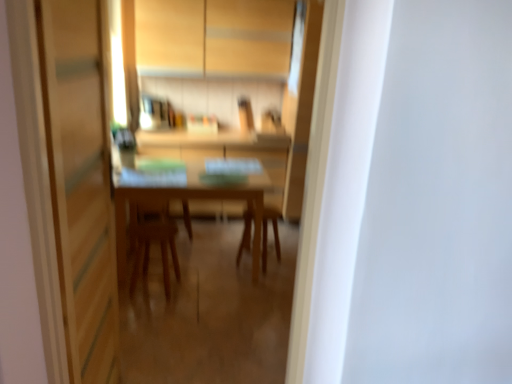
Describe the element at coordinates (152, 240) in the screenshot. I see `wooden chair at center` at that location.

The width and height of the screenshot is (512, 384). In order to click on wooden chair at center in this screenshot , I will do `click(152, 240)`.

Is wooden chair at center looking in the opposite direction of wooden chair at center?

No, wooden chair at center is not facing the opposite direction of wooden chair at center.

Does point (249, 228) come in front of point (174, 257)?

That is True.

From a real-world perspective, is wooden chair at center physically above wooden chair at center?

Yes, from a real-world perspective, wooden chair at center is over wooden chair at center

How different are the orientations of wooden chair at center and wooden chair at center in degrees?

The angle between the facing direction of wooden chair at center and the facing direction of wooden chair at center is 69.4 degrees.

Does wooden chair at center appear on the left side of wooden chair at center?

Indeed, wooden chair at center is positioned on the left side of wooden chair at center.

From the image's perspective, does wooden chair at center appear higher than wooden chair at center?

No, from the image's perspective, wooden chair at center is not on top of wooden chair at center.

Does wooden chair at center have a greater height compared to wooden chair at center?

Indeed, wooden chair at center has a greater height compared to wooden chair at center.

Considering the sizes of objects wooden chair at center and wooden chair at center in the image provided, who is wider, wooden chair at center or wooden chair at center?

Wider between the two is wooden chair at center.

Is wooden chair at center looking in the opposite direction of matte wood cabinetry at upper center?

No, matte wood cabinetry at upper center is not at the back of wooden chair at center.

From a real-world perspective, is wooden chair at center over matte wood cabinetry at upper center?

Incorrect, from a real-world perspective, wooden chair at center is lower than matte wood cabinetry at upper center.

Can you confirm if wooden chair at center is positioned to the right of matte wood cabinetry at upper center?

Incorrect, wooden chair at center is not on the right side of matte wood cabinetry at upper center.

Looking at this image, from the image's perspective, who appears lower, wooden chair at center or matte wood cabinetry at upper center?

From the image's view, wooden chair at center is below.

In terms of width, does transparent glass screen door at left look wider or thinner when compared to matte wood cabinetry at upper center?

Considering their sizes, transparent glass screen door at left looks slimmer than matte wood cabinetry at upper center.

Based on the photo, from a real-world perspective, is transparent glass screen door at left located higher than matte wood cabinetry at upper center?

Incorrect, from a real-world perspective, transparent glass screen door at left is lower than matte wood cabinetry at upper center.

Between point (105, 158) and point (234, 30), which one is positioned in front?

The point (105, 158) is in front.

Does transparent glass screen door at left have a lesser height compared to matte wood cabinetry at upper center?

Incorrect, the height of transparent glass screen door at left does not fall short of that of matte wood cabinetry at upper center.

Considering the positions of objects matte wood cabinetry at upper center and wooden chair at center in the image provided, who is in front, matte wood cabinetry at upper center or wooden chair at center?

wooden chair at center.

Can you confirm if matte wood cabinetry at upper center is bigger than wooden chair at center?

Correct, matte wood cabinetry at upper center is larger in size than wooden chair at center.

From the picture: How different are the orientations of matte wood cabinetry at upper center and wooden chair at center in degrees?

matte wood cabinetry at upper center and wooden chair at center are facing 164 degrees away from each other.

Is matte wood cabinetry at upper center positioned with its back to wooden chair at center?

matte wood cabinetry at upper center does not have its back to wooden chair at center.

Is wooden table at center next to transparent glass screen door at left and touching it?

No, wooden table at center is not next to transparent glass screen door at left.

Is wooden table at center looking in the opposite direction of transparent glass screen door at left?

wooden table at center is not turned away from transparent glass screen door at left.

Looking at this image, is wooden table at center inside the boundaries of transparent glass screen door at left, or outside?

wooden table at center is not inside transparent glass screen door at left, it's outside.

Which of these two, wooden table at center or transparent glass screen door at left, is smaller?

transparent glass screen door at left.

Is point (244, 233) closer or farther from the camera than point (141, 38)?

Point (244, 233) appears to be closer to the viewer than point (141, 38).

Is wooden chair at center touching matte wood cabinetry at upper center?

No, wooden chair at center is not next to matte wood cabinetry at upper center.

From a real-world perspective, is wooden chair at center positioned above or below matte wood cabinetry at upper center?

wooden chair at center is situated lower than matte wood cabinetry at upper center in the real world.

Who is bigger, wooden chair at center or matte wood cabinetry at upper center?

Bigger between the two is matte wood cabinetry at upper center.

The width and height of the screenshot is (512, 384). Identify the location of chair above the wooden chair at center (from a real-world perspective). pos(267,234).

The width and height of the screenshot is (512, 384). I want to click on chair behind the wooden chair at center, so click(x=267, y=234).

When comparing their distances from transparent glass screen door at left, does wooden table at center or wooden chair at center seem further?

The object further to transparent glass screen door at left is wooden chair at center.

Based on their spatial positions, is wooden table at center or wooden chair at center closer to matte wood cabinetry at upper center?

wooden table at center lies closer to matte wood cabinetry at upper center than the other object.

Based on their spatial positions, is wooden table at center or wooden chair at center closer to wooden chair at center?

Based on the image, wooden table at center appears to be nearer to wooden chair at center.

Considering their positions, is transparent glass screen door at left positioned closer to matte wood cabinetry at upper center than wooden chair at center?

Among the two, wooden chair at center is located nearer to matte wood cabinetry at upper center.

Estimate the real-world distances between objects in this image. Which object is closer to transparent glass screen door at left, wooden table at center or matte wood cabinetry at upper center?

wooden table at center.

Based on their spatial positions, is transparent glass screen door at left or matte wood cabinetry at upper center closer to wooden chair at center?

The object closer to wooden chair at center is transparent glass screen door at left.

Estimate the real-world distances between objects in this image. Which object is further from transparent glass screen door at left, wooden chair at center or wooden chair at center?

wooden chair at center is positioned further to the anchor transparent glass screen door at left.

Looking at the image, which one is located closer to transparent glass screen door at left, wooden table at center or wooden chair at center?

Among the two, wooden table at center is located nearer to transparent glass screen door at left.

At what (x,y) coordinates should I click in order to perform the action: click on armchair located between transparent glass screen door at left and matte wood cabinetry at upper center in the depth direction. Please return your answer as a coordinate pair (x, y). This screenshot has height=384, width=512. Looking at the image, I should click on (152, 240).

At what (x,y) coordinates should I click in order to perform the action: click on table located between transparent glass screen door at left and wooden chair at center in the depth direction. Please return your answer as a coordinate pair (x, y). Looking at the image, I should click on (186, 197).

Where is `armchair positioned between transparent glass screen door at left and wooden chair at center from near to far`? The width and height of the screenshot is (512, 384). armchair positioned between transparent glass screen door at left and wooden chair at center from near to far is located at coordinates (152, 240).

Where is `table located between transparent glass screen door at left and matte wood cabinetry at upper center in the depth direction`? The image size is (512, 384). table located between transparent glass screen door at left and matte wood cabinetry at upper center in the depth direction is located at coordinates (186, 197).